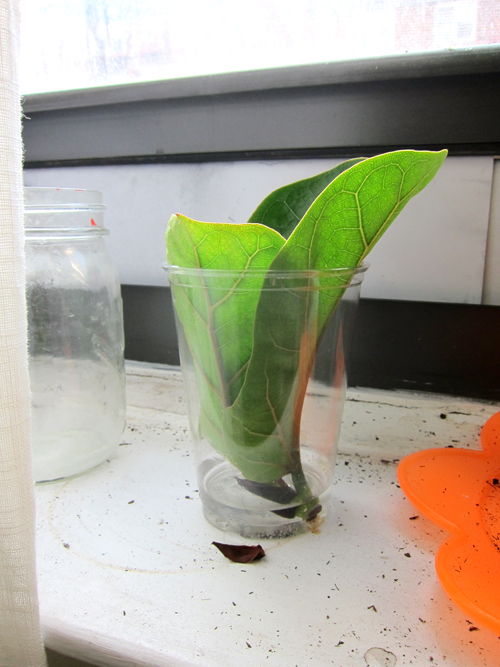
I want to click on beige curtain, so click(14, 115).